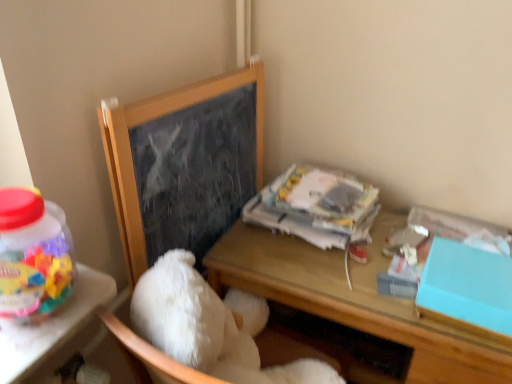
At what (x,y) coordinates should I click in order to perform the action: click on vacant space situated on the left part of teal matte box at right. Please return your answer as a coordinate pair (x, y). Looking at the image, I should click on (368, 283).